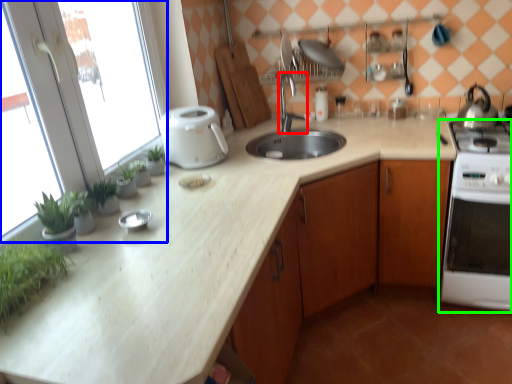
Question: Considering the real-world distances, which object is farthest from tap (highlighted by a red box)? window screen (highlighted by a blue box) or home appliance (highlighted by a green box)?

Choices:
 (A) window screen
 (B) home appliance

Answer: (A)